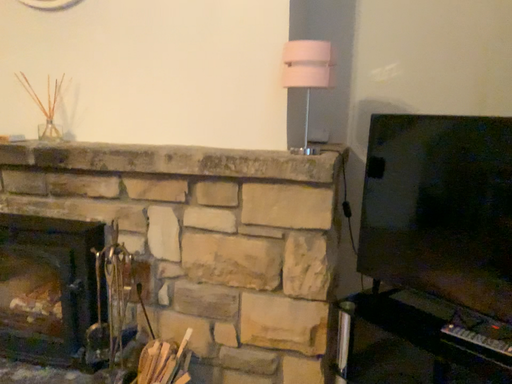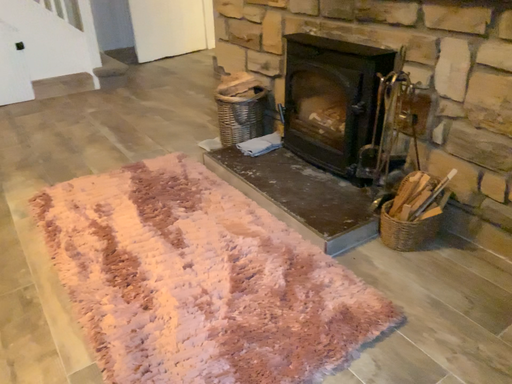
Question: How did the camera likely rotate when shooting the video?

Choices:
 (A) rotated right
 (B) rotated left

Answer: (B)